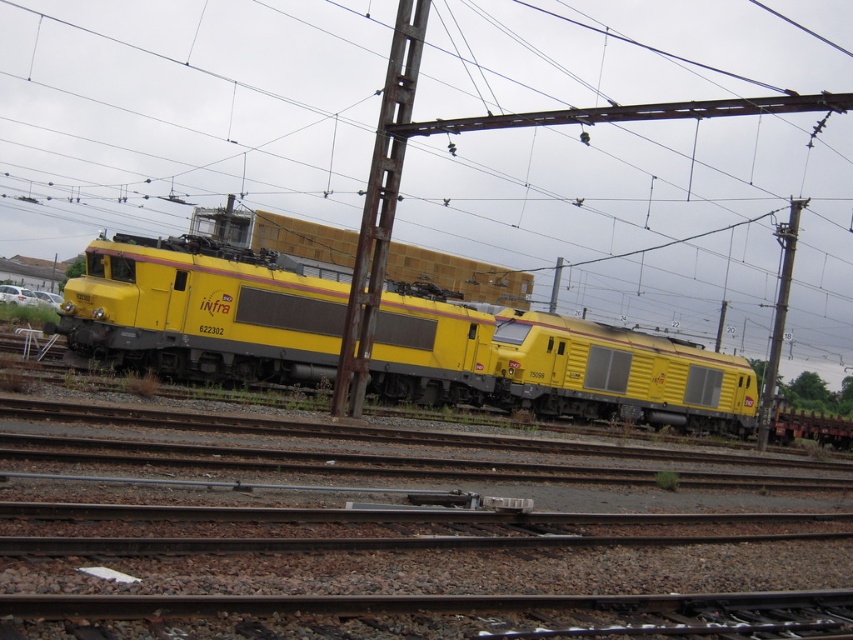
You are a railway worker standing at the edge of the tracks. You need to check the status of the metallic pole at right but must avoid the yellow matte train at center. Since the train is currently stationary, can you safely walk around it to reach the pole?

The yellow matte train at center is in front of the metallic pole at right, so the pole is behind the train from your perspective. Since the train is stationary, you can safely walk around it to reach the metallic pole at right.

You are a railway worker standing at the edge of the tracks. You need to inspect both the yellow matte train at center and the yellow matte train car at center. Which one should you check first if you want to start with the one nearest to you?

You should check the yellow matte train at center first because it is closer to you than the yellow matte train car at center.

You are a railway worker inspecting the tracks. You notice the yellow matte train car at center and the metallic pole at right. Which object is closer to you based on their sizes?

The yellow matte train car at center has a smaller size compared to the metallic pole at right, which indicates that the metallic pole at right is closer to you since smaller objects in the distance appear smaller.